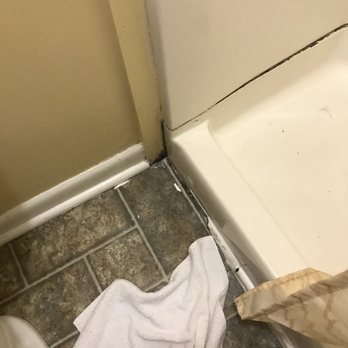
At what (x,y) coordinates should I click in order to perform the action: click on gray and brown tiled flooring. Please return your answer as a coordinate pair (x, y). Looking at the image, I should click on (86, 230).